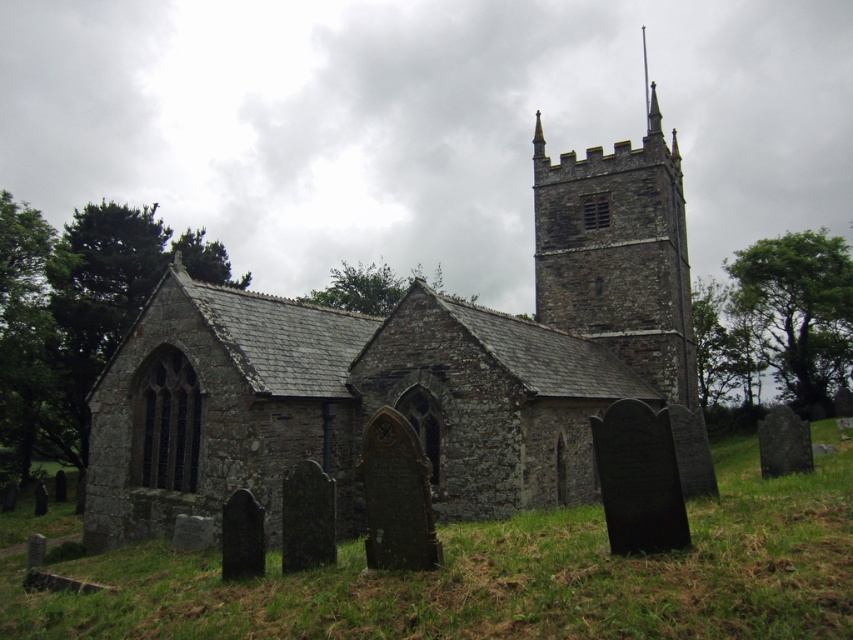
Is green grass at lower center taller than rustic stone tower at upper center?

No, green grass at lower center is not taller than rustic stone tower at upper center.

Can you confirm if green grass at lower center is positioned below rustic stone tower at upper center?

Yes.

Which is behind, point (720, 612) or point (537, 262)?

Positioned behind is point (537, 262).

At what (x,y) coordinates should I click in order to perform the action: click on green grass at lower center. Please return your answer as a coordinate pair (x, y). This screenshot has width=853, height=640. Looking at the image, I should click on (503, 576).

Is the position of stone church at center less distant than that of green grass at lower center?

No, it is behind green grass at lower center.

Measure the distance between point (189,486) and camera.

33.88 meters

This screenshot has height=640, width=853. Identify the location of stone church at center. (410, 369).

Who is taller, stone church at center or rustic stone tower at upper center?

rustic stone tower at upper center is taller.

Is stone church at center below rustic stone tower at upper center?

Indeed, stone church at center is positioned under rustic stone tower at upper center.

At what (x,y) coordinates should I click in order to perform the action: click on stone church at center. Please return your answer as a coordinate pair (x, y). Image resolution: width=853 pixels, height=640 pixels. Looking at the image, I should click on (410, 369).